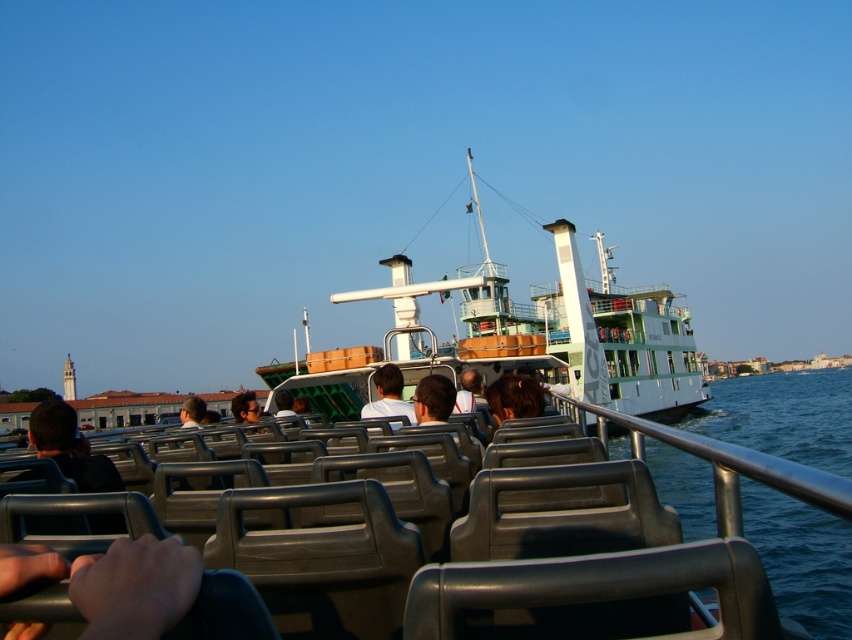
Question: Based on their relative distances, which object is farther from the white matte shirt at center?

Choices:
 (A) dark brown hair at center
 (B) green matte ferry at center

Answer: (B)

Question: Considering the real-world distances, which object is closest to the white matte shirt at center?

Choices:
 (A) dark brown hair at center
 (B) green matte ferry at center

Answer: (A)

Question: Can you confirm if white matte shirt at center is positioned to the left of dark brown hair at center?

Choices:
 (A) yes
 (B) no

Answer: (B)

Question: Does white matte shirt at center appear under dark brown hair at center?

Choices:
 (A) no
 (B) yes

Answer: (A)

Question: Is white matte shirt at center positioned at the back of dark brown hair at center?

Choices:
 (A) no
 (B) yes

Answer: (A)

Question: Which object is the closest to the dark brown hair at center?

Choices:
 (A) green matte ferry at center
 (B) white matte shirt at center

Answer: (B)